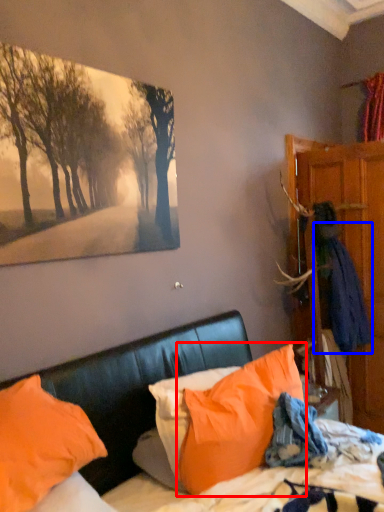
Question: Which of the following is the closest to the observer, pillow (highlighted by a red box) or clothing (highlighted by a blue box)?

Choices:
 (A) pillow
 (B) clothing

Answer: (A)